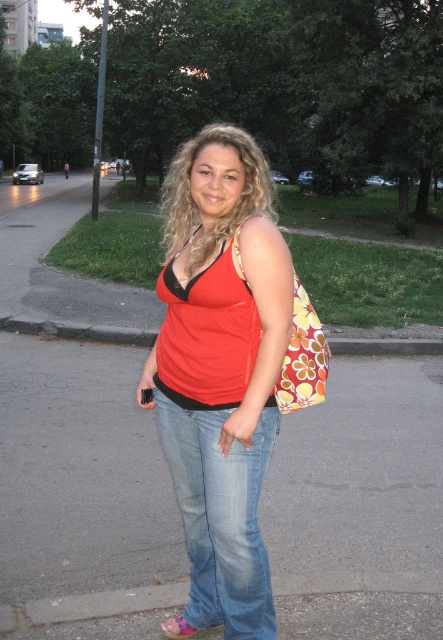
Consider the image. You are a photographer trying to capture a candid shot of the person in the scene. You need to ensure that both the floral fabric bag at right and the pink fabric sandal at lower center are visible in the frame. Given their distance apart, can you fit both into your camera viewfinder without moving closer or farther away?

The floral fabric bag at right and pink fabric sandal at lower center are 3.59 feet apart. Depending on your camera lens, if it has a wide enough angle to capture a 3.59 feet span at your current distance, both items can be included in the frame.

You are a delivery drone that needs to land on the gray asphalt pavement at center. However, there is a pink fabric sandal at lower center nearby. Can you safely land on the pavement without hitting the sandal?

The gray asphalt pavement at center is higher than the pink fabric sandal at lower center. Since the pavement is elevated, the drone can safely land there without hitting the sandal.